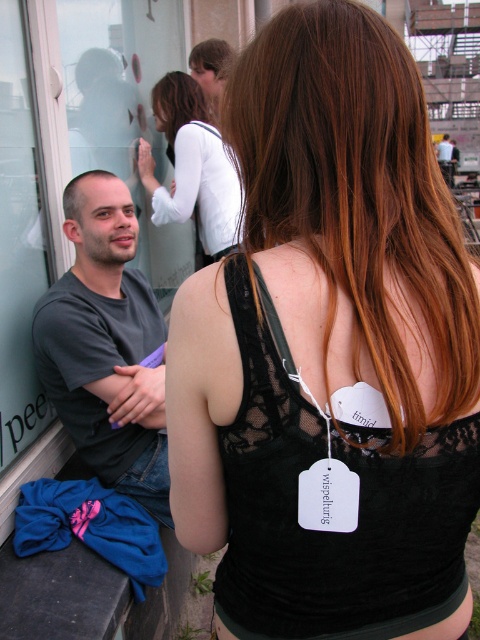
This screenshot has height=640, width=480. I want to click on dark gray t-shirt at left, so click(106, 346).

Does point (84, 307) come behind point (448, 138)?

That is False.

The image size is (480, 640). I want to click on dark gray t-shirt at left, so click(106, 346).

Who is lower down, white lace blouse at upper center or brownhair at upper center?

white lace blouse at upper center is below.

Does point (232, 240) come behind point (164, 116)?

That is False.

Is point (187, 115) closer to viewer compared to point (167, 122)?

That is True.

This screenshot has height=640, width=480. What are the coordinates of `white lace blouse at upper center` in the screenshot? It's located at click(x=192, y=166).

Who is positioned more to the left, dark gray t-shirt at left or brown matte hair at left?

From the viewer's perspective, brown matte hair at left appears more on the left side.

Which is behind, point (136, 310) or point (69, 182)?

Positioned behind is point (136, 310).

Where is `dark gray t-shirt at left`? This screenshot has width=480, height=640. dark gray t-shirt at left is located at coordinates (106, 346).